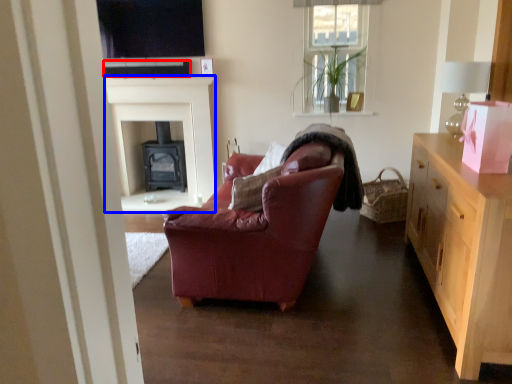
Question: Among these objects, which one is nearest to the camera, loudspeaker (highlighted by a red box) or fireplace (highlighted by a blue box)?

Choices:
 (A) loudspeaker
 (B) fireplace

Answer: (A)